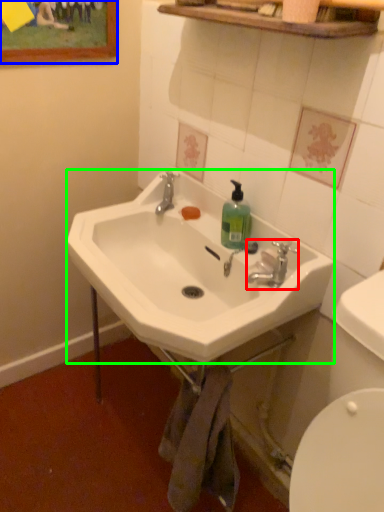
Question: Which is nearer to the plumbing fixture (highlighted by a red box)? picture frame (highlighted by a blue box) or sink (highlighted by a green box).

Choices:
 (A) picture frame
 (B) sink

Answer: (B)